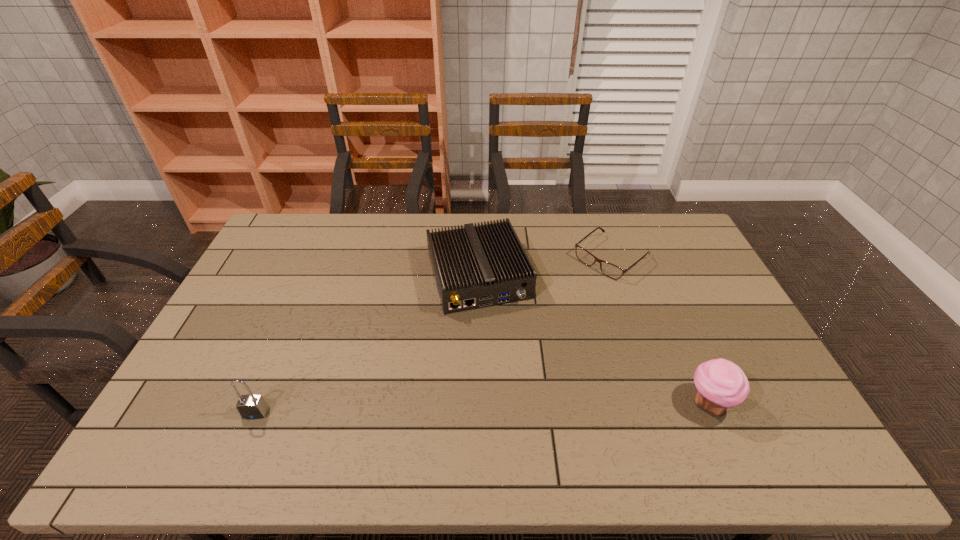
At what (x,y) coordinates should I click in order to perform the action: click on vacant space on the desktop that is between the leftmost object and the cupcake and is positioned on the back panel of the third object from right to left. Please return your answer as a coordinate pair (x, y). Looking at the image, I should click on (526, 407).

I want to click on vacant space on the desktop that is between the leftmost object and the cupcake and is positioned on the lenses of the spectacles, so click(424, 409).